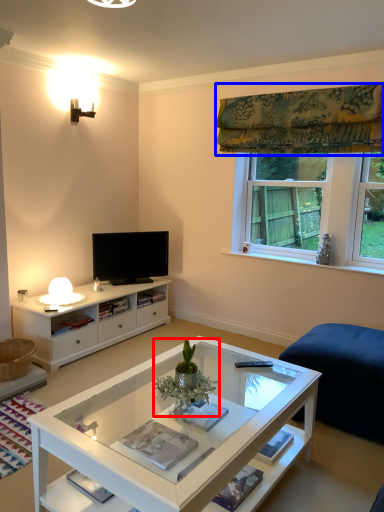
Question: Which object is further to the camera taking this photo, houseplant (highlighted by a red box) or curtain (highlighted by a blue box)?

Choices:
 (A) houseplant
 (B) curtain

Answer: (B)